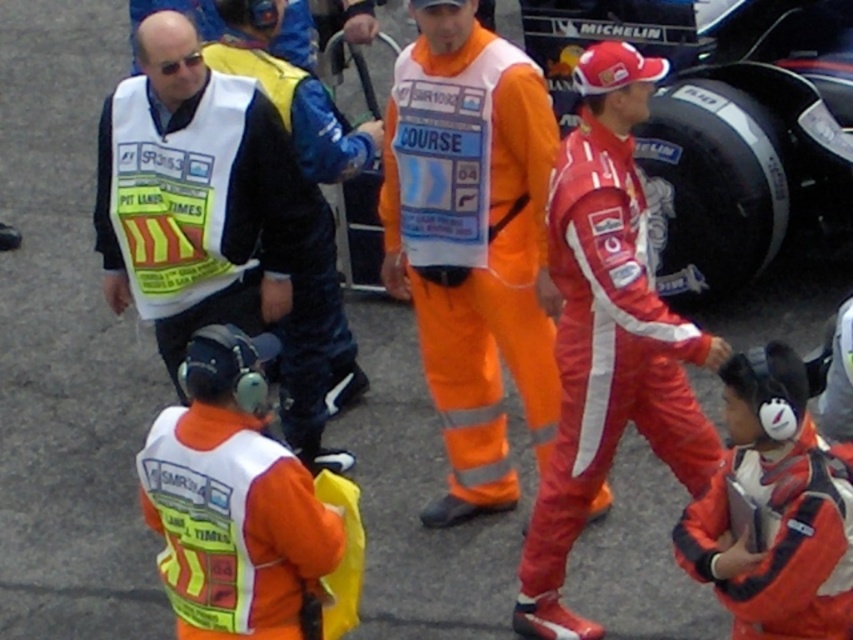
Question: Among these objects, which one is farthest from the camera?

Choices:
 (A) orange reflective jumpsuit at center
 (B) white reflective vest at left
 (C) reflective yellow vest at center

Answer: (C)

Question: Among these points, which one is farthest from the camera?

Choices:
 (A) (496, 321)
 (B) (321, 304)

Answer: (B)

Question: Which object appears closest to the camera in this image?

Choices:
 (A) white reflective vest at left
 (B) reflective yellow vest at center
 (C) orange reflective jumpsuit at center

Answer: (C)

Question: Does orange reflective jumpsuit at center have a greater width compared to white reflective vest at left?

Choices:
 (A) no
 (B) yes

Answer: (A)

Question: Does white reflective vest at left appear on the right side of reflective yellow vest at center?

Choices:
 (A) no
 (B) yes

Answer: (A)

Question: Does orange reflective jumpsuit at center have a greater width compared to reflective yellow vest at center?

Choices:
 (A) yes
 (B) no

Answer: (B)